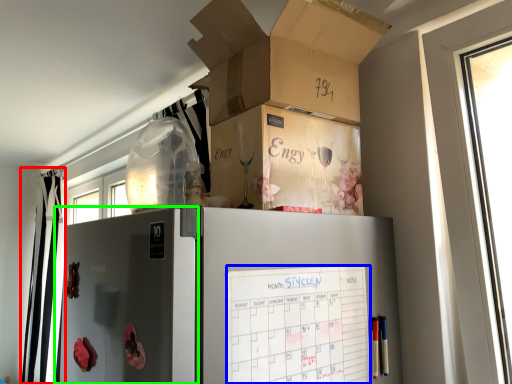
Question: Which is nearer to the curtain (highlighted by a red box)? checklist (highlighted by a blue box) or screen door (highlighted by a green box).

Choices:
 (A) checklist
 (B) screen door

Answer: (B)